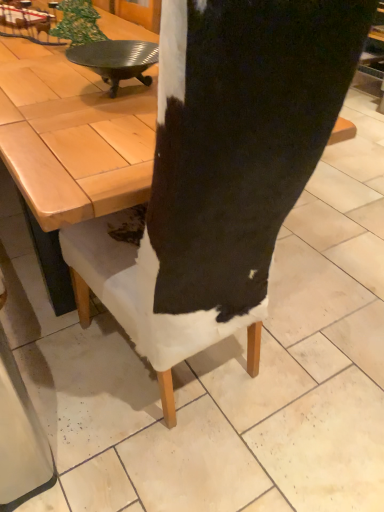
Question: Does point (145, 60) appear closer or farther from the camera than point (77, 153)?

Choices:
 (A) closer
 (B) farther

Answer: (B)

Question: Looking at their shapes, would you say metallic silver plate at upper left is wider or thinner than wooden at center?

Choices:
 (A) wide
 (B) thin

Answer: (B)

Question: Is metallic silver plate at upper left inside or outside of wooden at center?

Choices:
 (A) outside
 (B) inside

Answer: (A)

Question: From a real-world perspective, is wooden at center physically located above or below metallic silver plate at upper left?

Choices:
 (A) below
 (B) above

Answer: (A)

Question: Looking at their shapes, would you say wooden at center is wider or thinner than metallic silver plate at upper left?

Choices:
 (A) thin
 (B) wide

Answer: (B)

Question: From the image's perspective, relative to metallic silver plate at upper left, is wooden at center above or below?

Choices:
 (A) above
 (B) below

Answer: (A)

Question: Considering the positions of wooden at center and metallic silver plate at upper left in the image, is wooden at center taller or shorter than metallic silver plate at upper left?

Choices:
 (A) tall
 (B) short

Answer: (A)